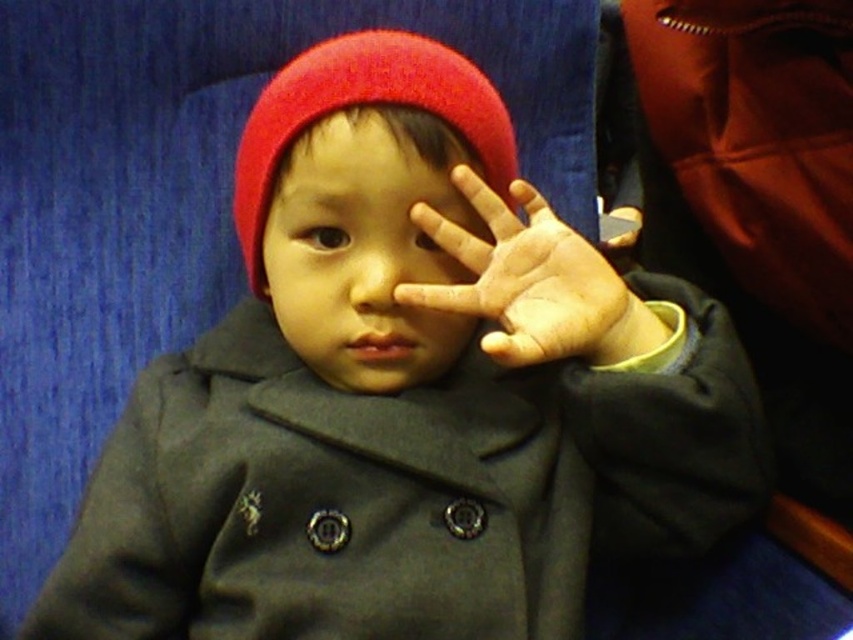
The width and height of the screenshot is (853, 640). I want to click on matte red beanie at center, so coord(367,248).

Between point (345, 260) and point (618, 304), which one is positioned in front?

Point (345, 260) is in front.

Image resolution: width=853 pixels, height=640 pixels. Find the location of `matte red beanie at center`. matte red beanie at center is located at coordinates [x=367, y=248].

Where is `matte red beanie at center`? matte red beanie at center is located at coordinates (367, 248).

Locate an element on the screen. matte red beanie at center is located at coordinates (367, 248).

From the picture: Is matte red beanie at center bigger than red woolen hat at center?

Incorrect, matte red beanie at center is not larger than red woolen hat at center.

Locate an element on the screen. matte red beanie at center is located at coordinates (367, 248).

Between dry skin palm at center and red woolen hat at center, which one appears on the left side from the viewer's perspective?

From the viewer's perspective, red woolen hat at center appears more on the left side.

Between point (485, 209) and point (277, 147), which one is positioned behind?

Positioned behind is point (277, 147).

You are a GUI agent. You are given a task and a screenshot of the screen. Output one action in this format:
    pyautogui.click(x=<x>, y=<y>)
    Task: Click on the dry skin palm at center
    This screenshot has height=640, width=853.
    Given the screenshot: What is the action you would take?
    pyautogui.click(x=531, y=282)